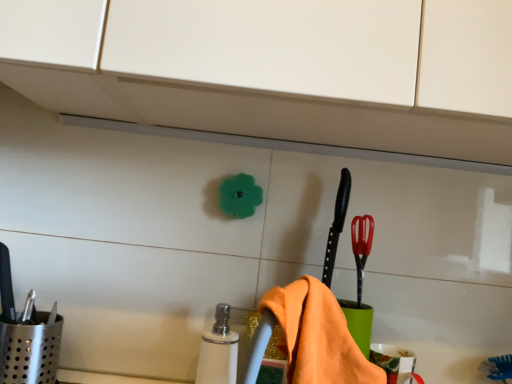
Question: Considering the positions of red plastic brush at right and orange cotton towel at lower center in the image, is red plastic brush at right bigger or smaller than orange cotton towel at lower center?

Choices:
 (A) small
 (B) big

Answer: (A)

Question: In terms of width, does red plastic brush at right look wider or thinner when compared to orange cotton towel at lower center?

Choices:
 (A) thin
 (B) wide

Answer: (A)

Question: Which object is the farthest from the white glossy soap dispenser at center?

Choices:
 (A) red plastic brush at right
 (B) orange cotton towel at lower center

Answer: (A)

Question: Which object is the closest to the red plastic brush at right?

Choices:
 (A) white glossy soap dispenser at center
 (B) orange cotton towel at lower center

Answer: (B)